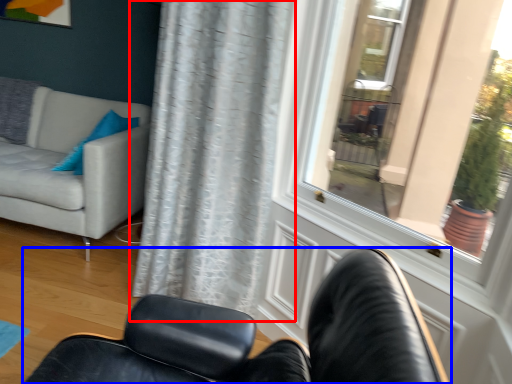
Question: Which of the following is the farthest to the observer, curtain (highlighted by a red box) or chair (highlighted by a blue box)?

Choices:
 (A) curtain
 (B) chair

Answer: (A)